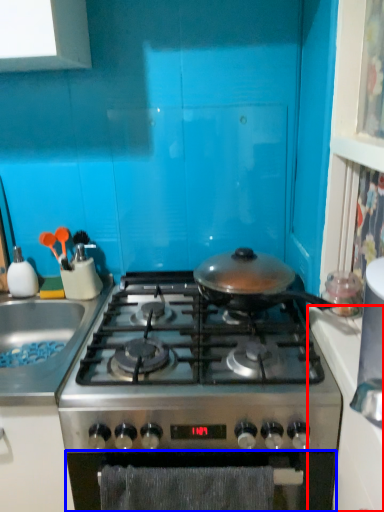
Question: Which of the following is the farthest to the observer, counter top (highlighted by a red box) or oven (highlighted by a blue box)?

Choices:
 (A) counter top
 (B) oven

Answer: (B)